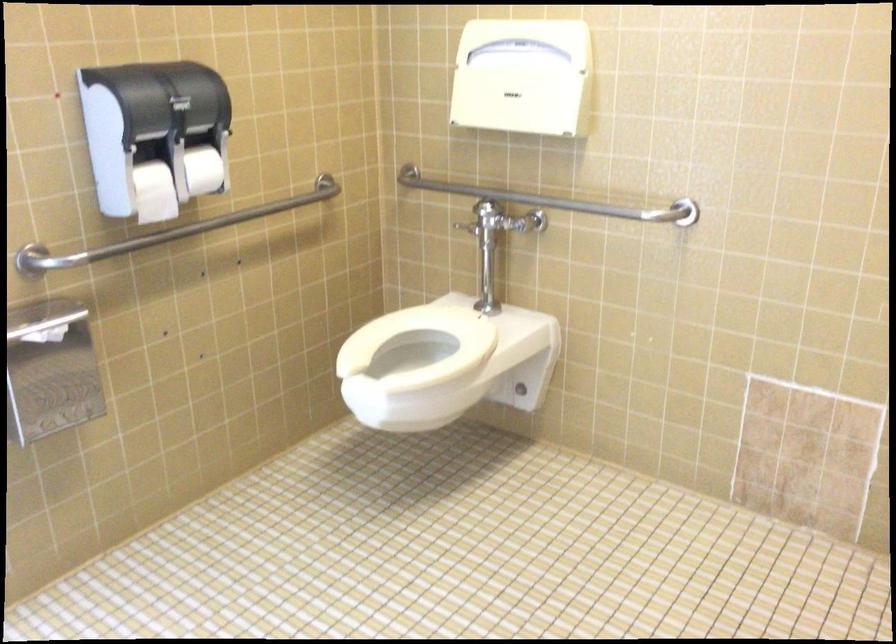
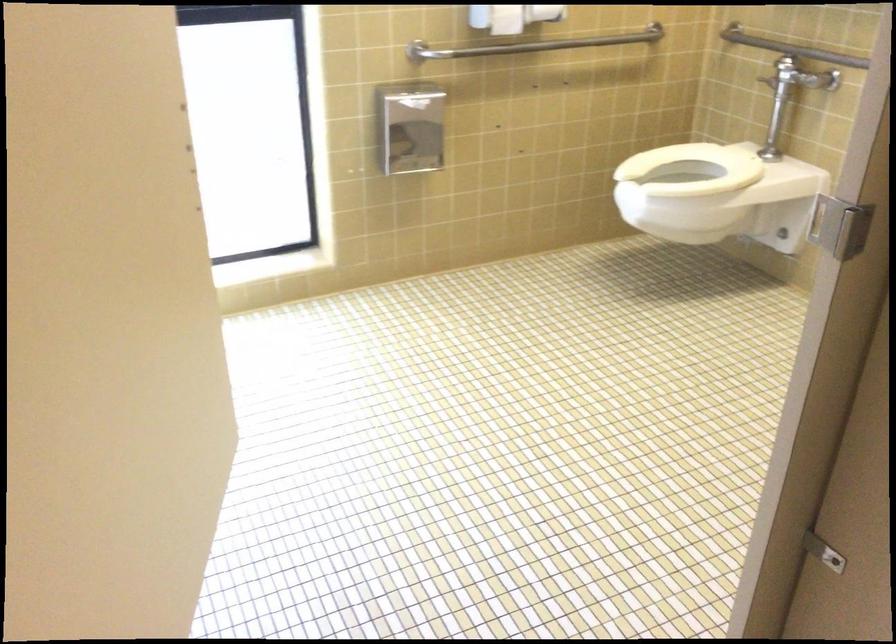
The point at (191,230) is marked in the first image. Where is the corresponding point in the second image?

(531, 44)